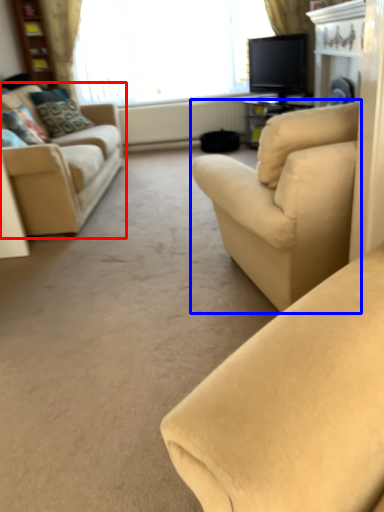
Question: Which object is closer to the camera taking this photo, studio couch (highlighted by a red box) or studio couch (highlighted by a blue box)?

Choices:
 (A) studio couch
 (B) studio couch

Answer: (B)